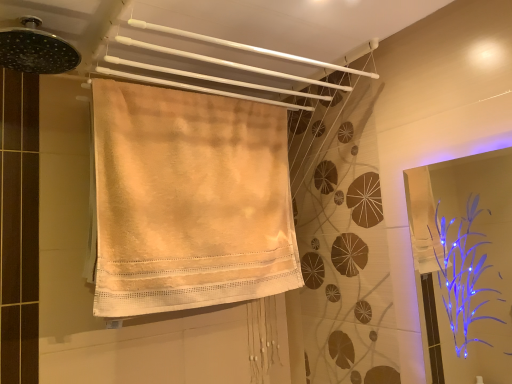
Question: Does black metallic shower head at upper left appear on the right side of beige cotton towel at upper center, positioned as the 1th towel in top-to-bottom order?

Choices:
 (A) yes
 (B) no

Answer: (B)

Question: Considering the relative sizes of black metallic shower head at upper left and beige cotton towel at upper center, which is the second towel in bottom-to-top order, in the image provided, is black metallic shower head at upper left taller than beige cotton towel at upper center, which is the second towel in bottom-to-top order,?

Choices:
 (A) no
 (B) yes

Answer: (A)

Question: Are black metallic shower head at upper left and beige cotton towel at upper center, which is the second towel in bottom-to-top order, beside each other?

Choices:
 (A) no
 (B) yes

Answer: (A)

Question: Is black metallic shower head at upper left completely or partially outside of beige cotton towel at upper center, which is the second towel in bottom-to-top order?

Choices:
 (A) no
 (B) yes

Answer: (B)

Question: Is beige cotton towel at upper center, which is the second towel in bottom-to-top order, at the back of black metallic shower head at upper left?

Choices:
 (A) yes
 (B) no

Answer: (B)

Question: Is beige cotton towel at center, marked as the 1th towel in a bottom-to-top arrangement, inside or outside of transparent plastic screen door at right?

Choices:
 (A) inside
 (B) outside

Answer: (B)

Question: Relative to transparent plastic screen door at right, is beige cotton towel at center, marked as the 1th towel in a bottom-to-top arrangement, in front or behind?

Choices:
 (A) behind
 (B) front

Answer: (A)

Question: Looking at the image, does beige cotton towel at center, marked as the 1th towel in a bottom-to-top arrangement, seem bigger or smaller compared to transparent plastic screen door at right?

Choices:
 (A) big
 (B) small

Answer: (A)

Question: Is beige cotton towel at center, marked as the 1th towel in a bottom-to-top arrangement, taller or shorter than transparent plastic screen door at right?

Choices:
 (A) tall
 (B) short

Answer: (A)

Question: Looking at their shapes, would you say transparent plastic screen door at right is wider or thinner than beige cotton towel at center, the second towel positioned from the top?

Choices:
 (A) thin
 (B) wide

Answer: (A)

Question: In terms of height, does transparent plastic screen door at right look taller or shorter compared to beige cotton towel at center, the second towel positioned from the top?

Choices:
 (A) short
 (B) tall

Answer: (A)

Question: From the image's perspective, relative to beige cotton towel at center, the second towel positioned from the top, is transparent plastic screen door at right above or below?

Choices:
 (A) below
 (B) above

Answer: (A)

Question: Is transparent plastic screen door at right to the left or to the right of beige cotton towel at center, marked as the 1th towel in a bottom-to-top arrangement, in the image?

Choices:
 (A) left
 (B) right

Answer: (B)

Question: Is point pyautogui.click(x=493, y=173) closer or farther from the camera than point pyautogui.click(x=304, y=59)?

Choices:
 (A) farther
 (B) closer

Answer: (A)

Question: In terms of width, does transparent plastic screen door at right look wider or thinner when compared to beige cotton towel at upper center, positioned as the 1th towel in top-to-bottom order?

Choices:
 (A) wide
 (B) thin

Answer: (B)